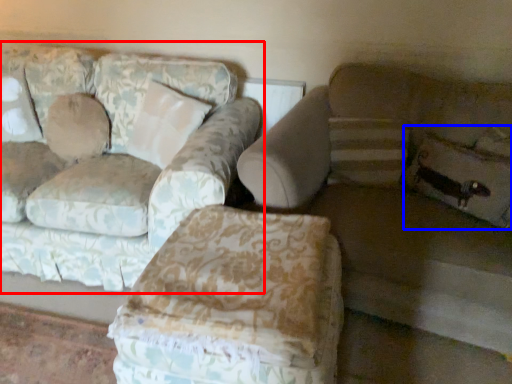
Question: Which object is closer to the camera taking this photo, studio couch (highlighted by a red box) or pillow (highlighted by a blue box)?

Choices:
 (A) studio couch
 (B) pillow

Answer: (A)